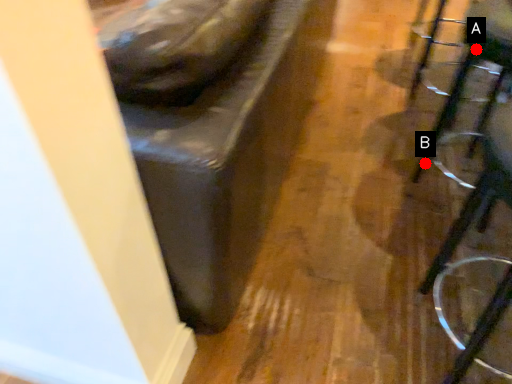
Question: Two points are circled on the image, labeled by A and B beside each circle. Among these points, which one is farthest from the camera?

Choices:
 (A) A is further
 (B) B is further

Answer: (B)